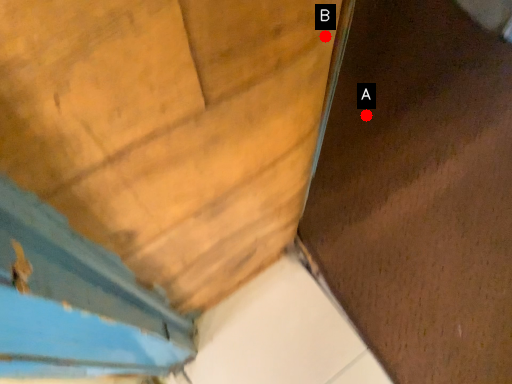
Question: Two points are circled on the image, labeled by A and B beside each circle. Which point is further to the camera?

Choices:
 (A) A is further
 (B) B is further

Answer: (A)